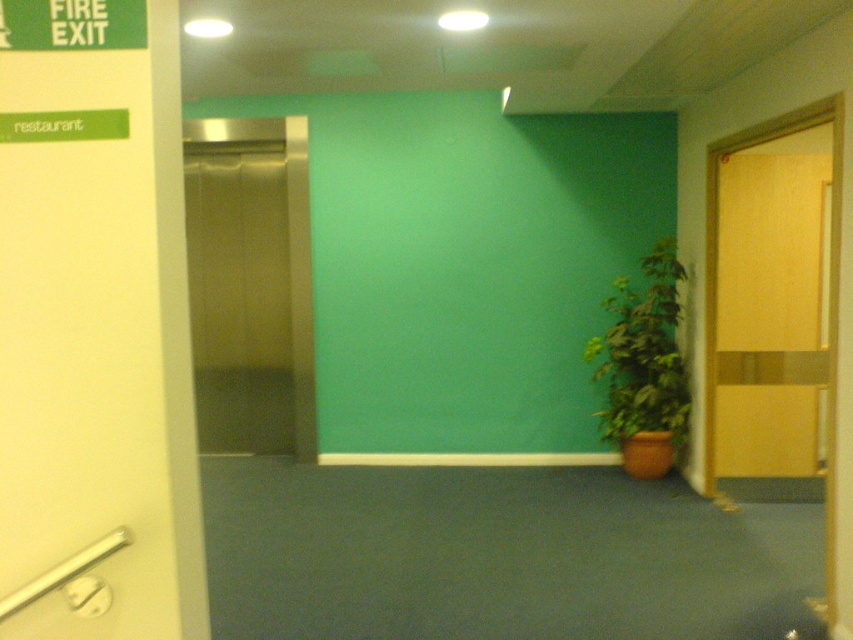
You are a delivery person with a package that requires a clear path to the elevator. You see the wooden at right and the stainless steel elevator at left. Can you move the package through the space between them?

The wooden at right is 2.67 meters away from the stainless steel elevator at left. Since the distance between them is sufficient, the package can be moved through the space between them.

You are standing at the point labeled point (x=250, y=284) in the image. Which object are you closest to?

You are closest to the stainless steel elevator at left because the point (x=250, y=284) is on the stainless steel elevator at left.

You are standing in the building and want to reach the wooden at right. Is it located below the stainless steel elevator at left?

Yes, the wooden at right is positioned under the stainless steel elevator at left, so it is located below the elevator.